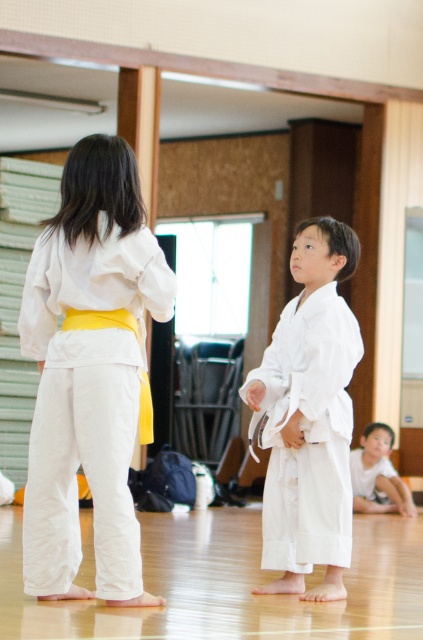
Describe the element at coordinates (310, 417) in the screenshot. I see `white cotton kimono at center` at that location.

Does white cotton kimono at center appear on the left side of smooth white karate gi at lower right?

Indeed, white cotton kimono at center is positioned on the left side of smooth white karate gi at lower right.

This screenshot has width=423, height=640. What do you see at coordinates (310, 417) in the screenshot? I see `white cotton kimono at center` at bounding box center [310, 417].

At what (x,y) coordinates should I click in order to perform the action: click on white cotton kimono at center. Please return your answer as a coordinate pair (x, y). Looking at the image, I should click on coord(310,417).

Is white cotton karate gi at center positioned before smooth white karate gi at lower right?

That is True.

Who is lower down, white cotton karate gi at center or smooth white karate gi at lower right?

smooth white karate gi at lower right is lower down.

Image resolution: width=423 pixels, height=640 pixels. Describe the element at coordinates (90, 372) in the screenshot. I see `white cotton karate gi at center` at that location.

I want to click on white cotton karate gi at center, so click(x=90, y=372).

Is the position of white cotton karate gi at center more distant than that of white cotton kimono at center?

No, it is not.

The width and height of the screenshot is (423, 640). I want to click on white cotton karate gi at center, so click(90, 372).

Consider the image. Who is more forward, (115,593) or (312,257)?

Point (115,593) is more forward.

Identify the location of white cotton karate gi at center. This screenshot has height=640, width=423. (90, 372).